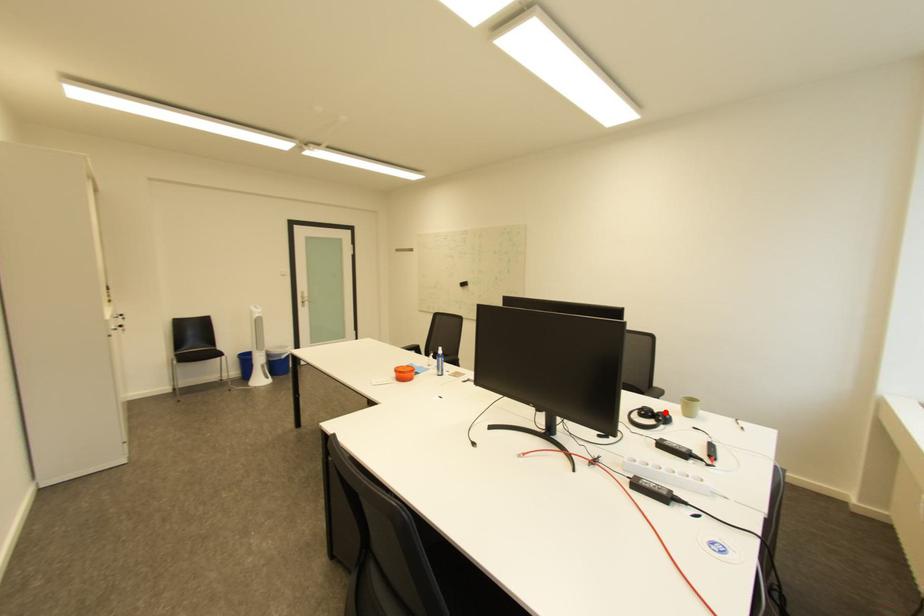
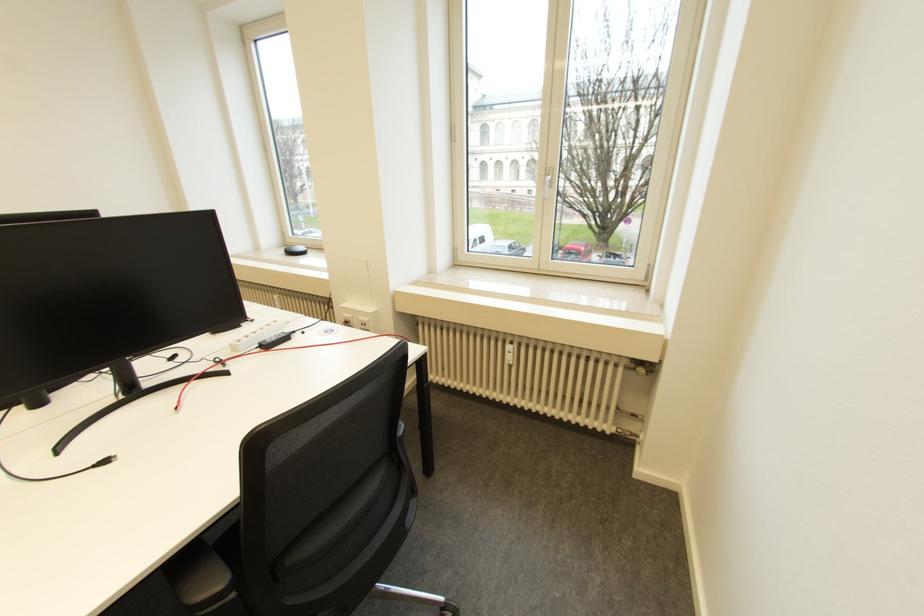
Question: I am providing you with two images of the same scene from different viewpoints. A red point is marked on the first image. At the location where the point appears in image 1, is it still visible in image 2?

Choices:
 (A) Yes
 (B) No

Answer: (B)